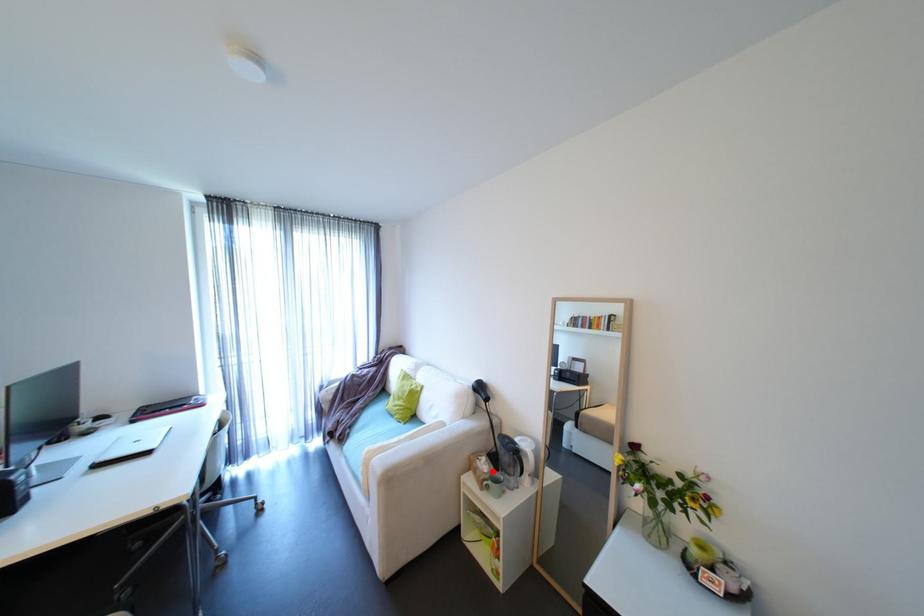
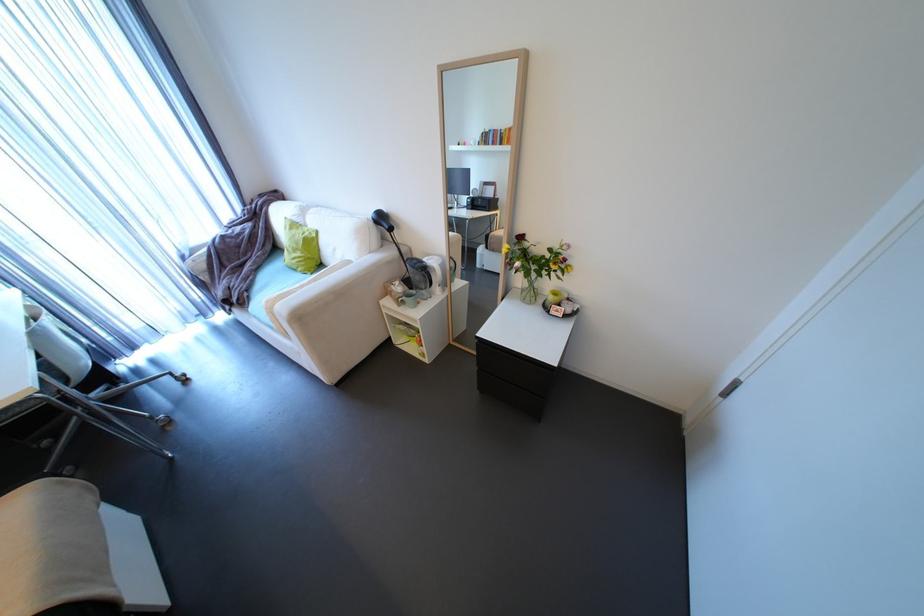
The point at the highlighted location is marked in the first image. Where is the corresponding point in the second image?

(407, 292)